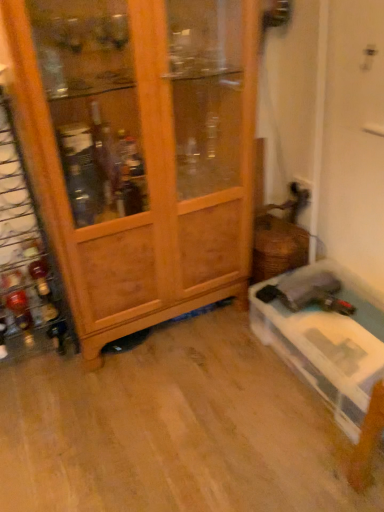
Question: In the image, is translucent glass bottle at left, the second bottle when ordered from top to bottom, positioned in front of or behind shiny amber glass bottle at left, acting as the 1th bottle starting from the top?

Choices:
 (A) front
 (B) behind

Answer: (B)

Question: Is translucent glass bottle at left, the 1th bottle positioned from the bottom, wider or thinner than shiny amber glass bottle at left, acting as the 1th bottle starting from the top?

Choices:
 (A) wide
 (B) thin

Answer: (A)

Question: Considering the real-world distances, which object is closest to the wooden wine rack at left?

Choices:
 (A) shiny amber glass bottle at left, which is the second bottle from bottom to top
 (B) wooden cabinet at left
 (C) translucent glass bottle at left, the 1th bottle positioned from the bottom

Answer: (A)

Question: Which is nearer to the wooden cabinet at left?

Choices:
 (A) translucent glass bottle at left, the 1th bottle positioned from the bottom
 (B) shiny amber glass bottle at left, acting as the 1th bottle starting from the top
 (C) wooden wine rack at left

Answer: (C)